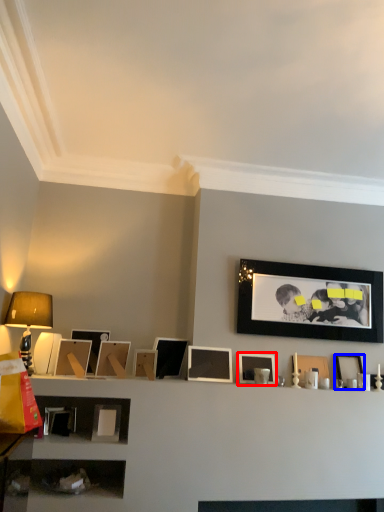
Question: Which object appears farthest to the camera in this image, picture frame (highlighted by a red box) or picture frame (highlighted by a blue box)?

Choices:
 (A) picture frame
 (B) picture frame

Answer: (B)